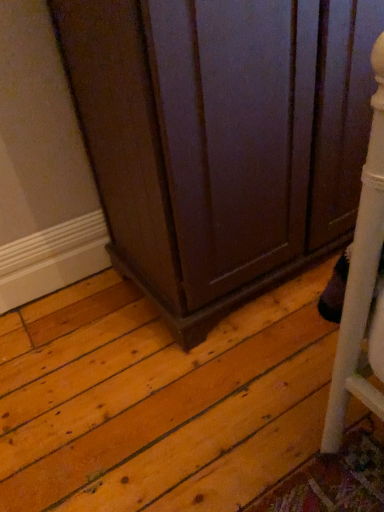
Describe the element at coordinates (221, 138) in the screenshot. I see `dark wood cabinet at center` at that location.

The width and height of the screenshot is (384, 512). I want to click on dark wood cabinet at center, so click(221, 138).

The image size is (384, 512). Find the location of `dark wood cabinet at center`. dark wood cabinet at center is located at coordinates (221, 138).